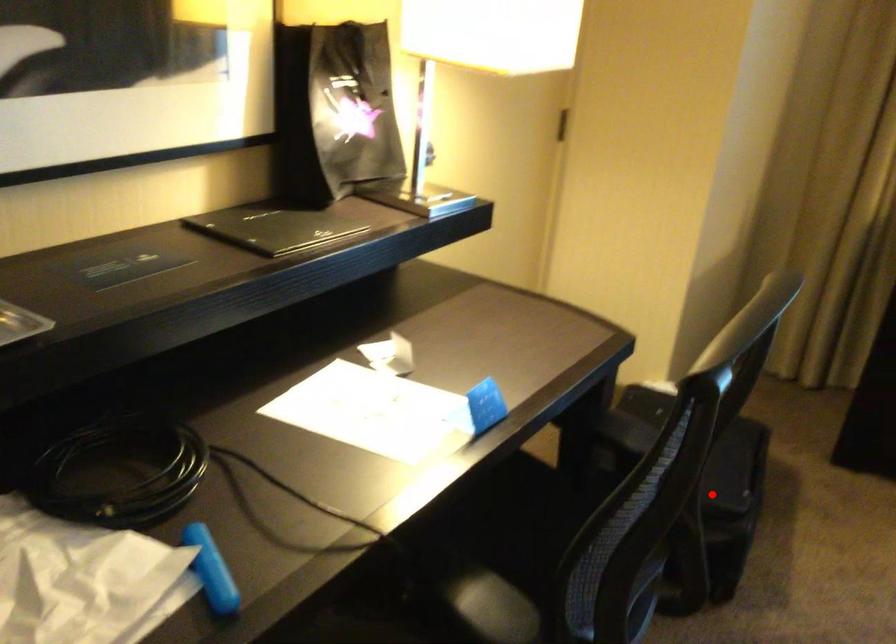
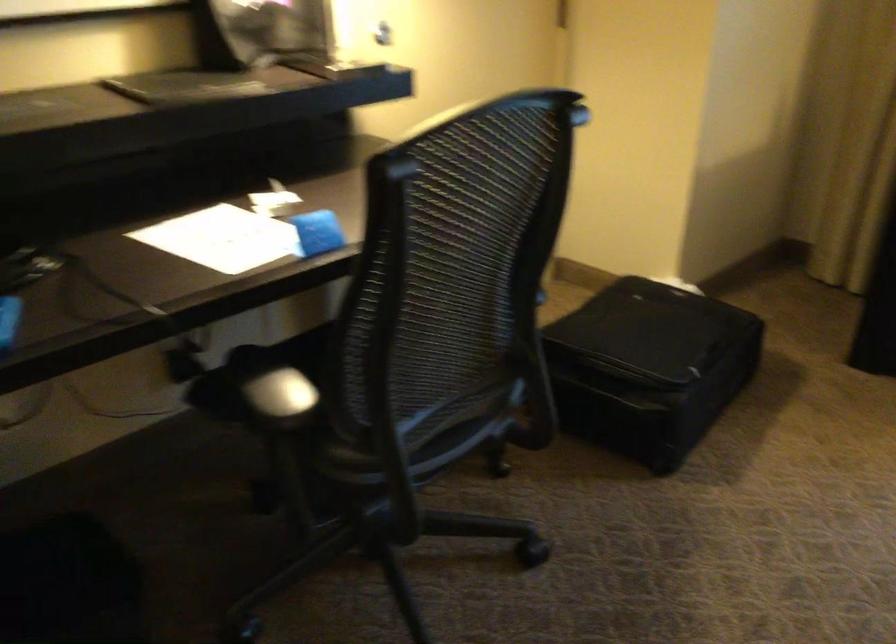
Where in the second image is the point corresponding to the highlighted location from the first image?

(649, 366)